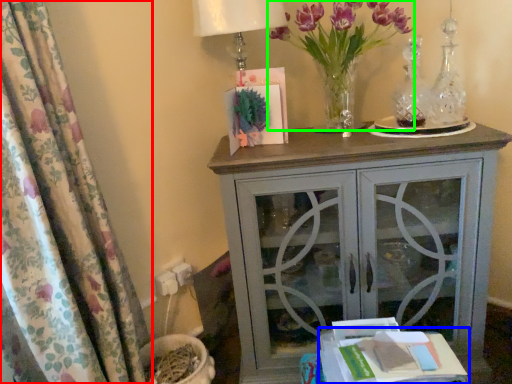
Question: Which object is positioned closest to curtain (highlighted by a red box)? Select from table (highlighted by a blue box) and floral arrangement (highlighted by a green box).

Choices:
 (A) table
 (B) floral arrangement

Answer: (A)